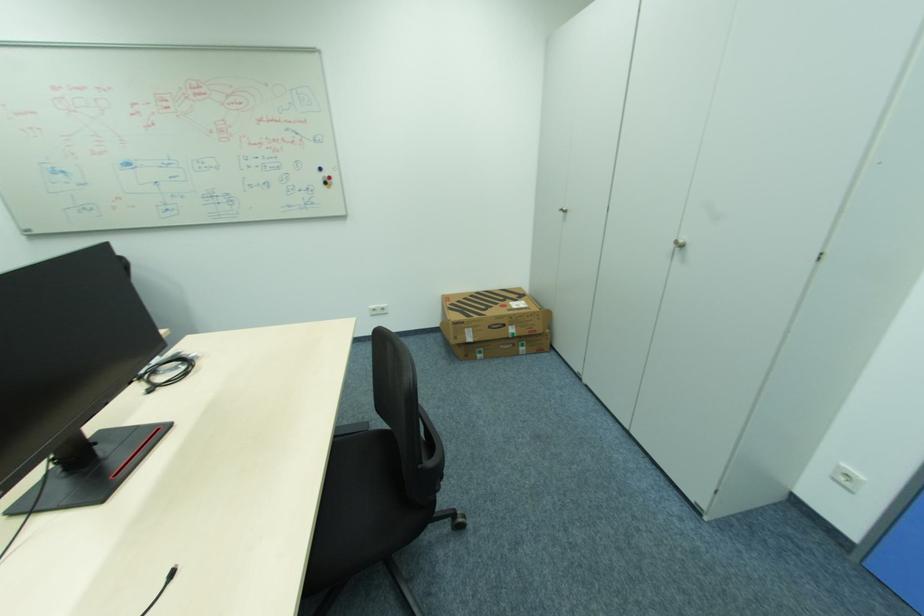
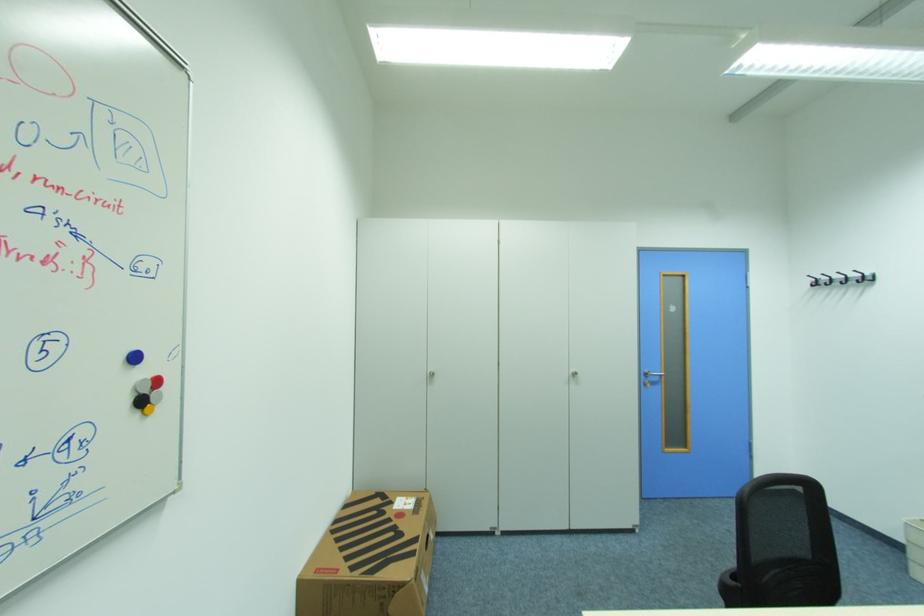
Find the pixel in the second image that matches point (324, 169) in the first image.

(140, 359)